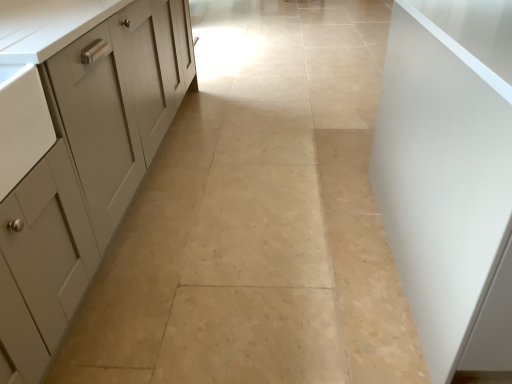
What is the approximate width of white matte cabinet at right?

white matte cabinet at right is 5.15 feet wide.

What do you see at coordinates (450, 177) in the screenshot? I see `white matte cabinet at right` at bounding box center [450, 177].

I want to click on white matte cabinet at right, so click(x=450, y=177).

I want to click on white matte cabinet at right, so click(450, 177).